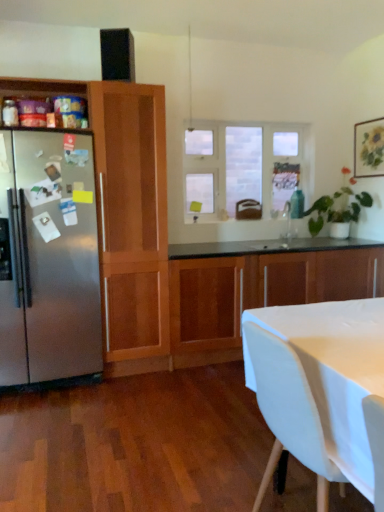
Question: Considering the relative positions of satin stainless steel refrigerator at left and clear glass window at center in the image provided, is satin stainless steel refrigerator at left to the right of clear glass window at center from the viewer's perspective?

Choices:
 (A) yes
 (B) no

Answer: (B)

Question: From the image's perspective, is satin stainless steel refrigerator at left on top of clear glass window at center?

Choices:
 (A) no
 (B) yes

Answer: (A)

Question: From a real-world perspective, is satin stainless steel refrigerator at left physically below clear glass window at center?

Choices:
 (A) no
 (B) yes

Answer: (B)

Question: Would you consider satin stainless steel refrigerator at left to be distant from clear glass window at center?

Choices:
 (A) yes
 (B) no

Answer: (A)

Question: Does satin stainless steel refrigerator at left have a greater height compared to clear glass window at center?

Choices:
 (A) no
 (B) yes

Answer: (B)

Question: Can you confirm if satin stainless steel refrigerator at left is positioned to the left of clear glass window at center?

Choices:
 (A) no
 (B) yes

Answer: (B)

Question: Is wooden cabinet at center, the second cabinetry positioned from the left, positioned before white fabric chair at lower right?

Choices:
 (A) no
 (B) yes

Answer: (A)

Question: From the image's perspective, is wooden cabinet at center, the second cabinetry positioned from the left, above white fabric chair at lower right?

Choices:
 (A) no
 (B) yes

Answer: (B)

Question: Can you see wooden cabinet at center, the 1th cabinetry from the right, touching white fabric chair at lower right?

Choices:
 (A) yes
 (B) no

Answer: (B)

Question: Is wooden cabinet at center, the 1th cabinetry from the right, aimed at white fabric chair at lower right?

Choices:
 (A) yes
 (B) no

Answer: (A)

Question: Does wooden cabinet at center, the 1th cabinetry from the right, come behind white fabric chair at lower right?

Choices:
 (A) yes
 (B) no

Answer: (A)

Question: Can you confirm if wooden cabinet at center, the 1th cabinetry from the right, is bigger than white fabric chair at lower right?

Choices:
 (A) no
 (B) yes

Answer: (B)

Question: From a real-world perspective, does white fabric chair at lower right stand above clear glass window at center?

Choices:
 (A) no
 (B) yes

Answer: (A)